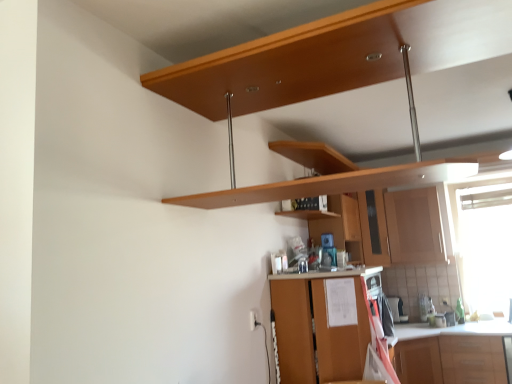
Question: From the image's perspective, is wooden shelf at center positioned above or below wooden cabinet at center, which is counted as the first cabinetry, starting from the back?

Choices:
 (A) below
 (B) above

Answer: (B)

Question: Relative to wooden cabinet at center, which is counted as the third cabinetry, starting from the front, is wooden shelf at center in front or behind?

Choices:
 (A) behind
 (B) front

Answer: (B)

Question: Estimate the real-world distances between objects in this image. Which object is closer to the wooden shelf at center?

Choices:
 (A) transparent plastic window screen at right
 (B) satin black coffee maker at lower right
 (C) matte wood cabinet at center-right, acting as the 2th cabinetry starting from the back
 (D) wooden cabinet at center, which is counted as the first cabinetry, starting from the back
 (E) white glossy electric outlet at lower center

Answer: (D)

Question: Which object is the closest to the wooden cabinet at center, which is counted as the third cabinetry, starting from the front?

Choices:
 (A) transparent plastic window screen at right
 (B) brown wood cabinet at lower center, the third cabinetry positioned from the back
 (C) white glossy electric outlet at lower center
 (D) matte wood cabinet at center-right, acting as the 2th cabinetry starting from the back
 (E) satin black coffee maker at lower right

Answer: (D)